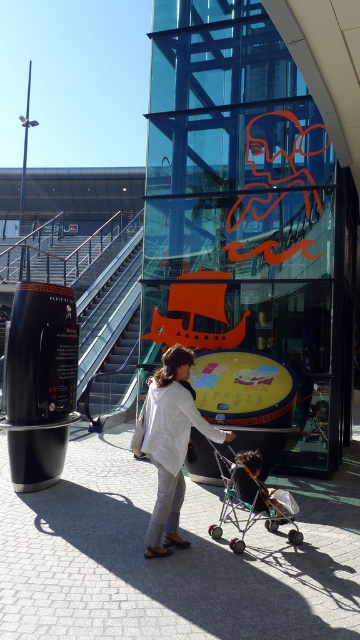
You are a parent with a metallic silver stroller at center. You want to take the metallic silver escalator at center to go upstairs. Is the stroller width safe to fit on the escalator?

The metallic silver escalator at center is wider than the metallic silver stroller at center, so the stroller will fit safely on the escalator.

You are a visitor at the entrance of a building and see the metallic silver escalator at center and the white matte lab coat at center. Which object is closer to you?

The metallic silver escalator at center is closer to you because the white matte lab coat at center is behind it.